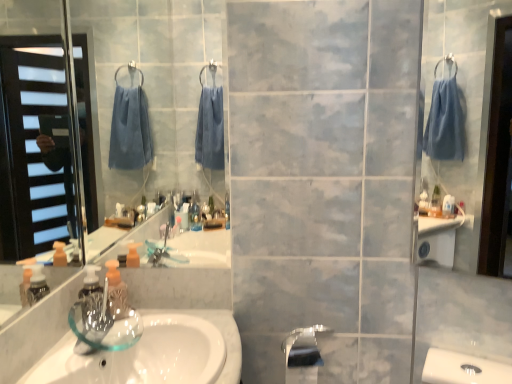
Question: Does white glossy sink at lower left touch satin nickel faucet at lower center?

Choices:
 (A) no
 (B) yes

Answer: (A)

Question: Can you confirm if white glossy sink at lower left is shorter than satin nickel faucet at lower center?

Choices:
 (A) yes
 (B) no

Answer: (B)

Question: Is white glossy sink at lower left not close to satin nickel faucet at lower center?

Choices:
 (A) yes
 (B) no

Answer: (B)

Question: Does white glossy sink at lower left have a lesser width compared to satin nickel faucet at lower center?

Choices:
 (A) yes
 (B) no

Answer: (B)

Question: From the image's perspective, is white glossy sink at lower left over satin nickel faucet at lower center?

Choices:
 (A) no
 (B) yes

Answer: (A)

Question: Is white glossy sink at lower left bigger than satin nickel faucet at lower center?

Choices:
 (A) yes
 (B) no

Answer: (A)

Question: Does satin nickel faucet at lower center appear on the right side of satin nickel faucet at lower center?

Choices:
 (A) yes
 (B) no

Answer: (A)

Question: From the image's perspective, is satin nickel faucet at lower center beneath satin nickel faucet at lower center?

Choices:
 (A) yes
 (B) no

Answer: (B)

Question: Does satin nickel faucet at lower center have a greater width compared to satin nickel faucet at lower center?

Choices:
 (A) yes
 (B) no

Answer: (A)

Question: Is the depth of satin nickel faucet at lower center less than that of satin nickel faucet at lower center?

Choices:
 (A) yes
 (B) no

Answer: (A)

Question: Is satin nickel faucet at lower center thinner than satin nickel faucet at lower center?

Choices:
 (A) no
 (B) yes

Answer: (A)

Question: Can you confirm if satin nickel faucet at lower center is shorter than satin nickel faucet at lower center?

Choices:
 (A) yes
 (B) no

Answer: (A)

Question: Does transparent glass soap dispenser at lower left lie behind white glossy sink at lower left?

Choices:
 (A) no
 (B) yes

Answer: (B)